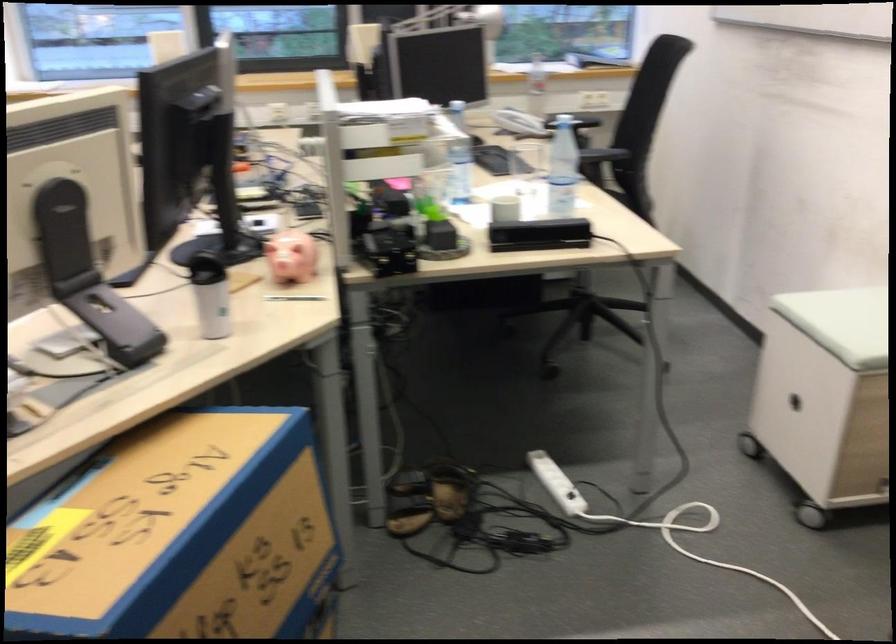
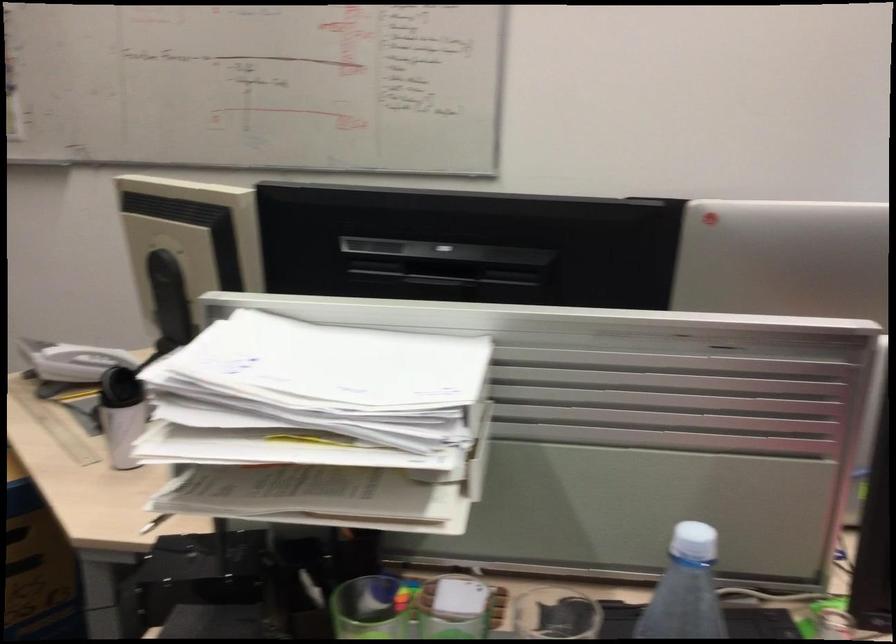
Question: I am providing you with two images of the same scene from different viewpoints. Please identify which objects are invisible in image2.

Choices:
 (A) red desk lamp
 (B) black kinect sensor
 (C) green pen holder
 (D) white paper tray

Answer: (B)